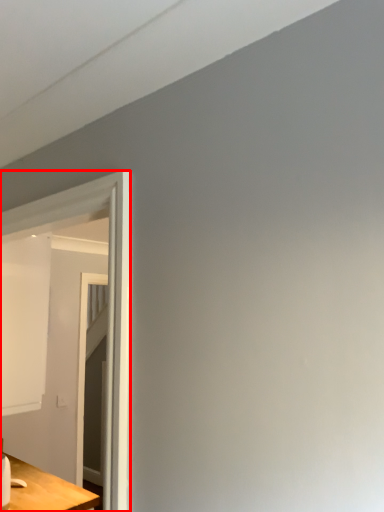
Question: From the image's perspective, what is the correct spatial positioning of glass door (annotated by the red box) in reference to table?

Choices:
 (A) below
 (B) above

Answer: (B)